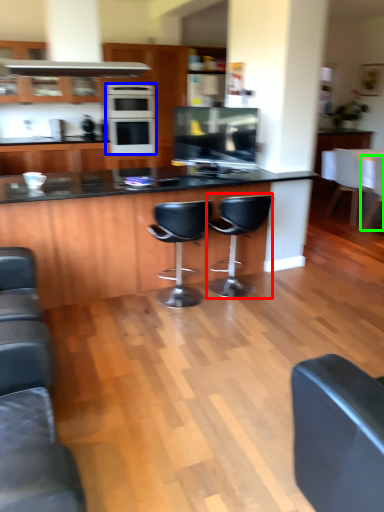
Question: Which is farther away from chair (highlighted by a red box)? kitchen appliance (highlighted by a blue box) or chair (highlighted by a green box)?

Choices:
 (A) kitchen appliance
 (B) chair

Answer: (B)